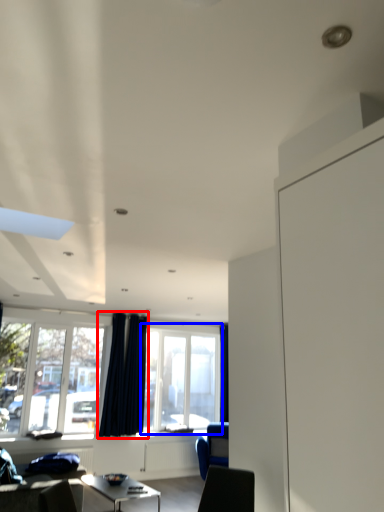
Question: Which point is closer to the camera, curtain (highlighted by a red box) or window (highlighted by a blue box)?

Choices:
 (A) curtain
 (B) window

Answer: (A)